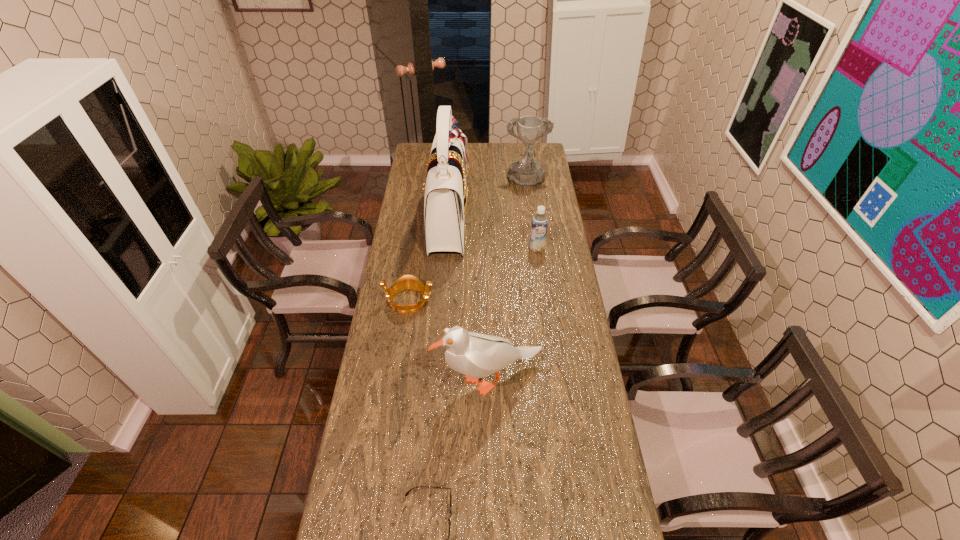
Identify the location of the tallest object. The image size is (960, 540). (x=446, y=196).

Image resolution: width=960 pixels, height=540 pixels. Find the location of `award`. award is located at coordinates (527, 172).

This screenshot has height=540, width=960. I want to click on gull, so click(x=475, y=355).

The image size is (960, 540). In order to click on the third shortest object in this screenshot , I will do `click(539, 223)`.

Locate an element on the screen. This screenshot has width=960, height=540. the second shortest object is located at coordinates (408, 282).

Where is `the fourth farthest object`? The image size is (960, 540). the fourth farthest object is located at coordinates click(408, 282).

This screenshot has height=540, width=960. I want to click on vacant space located on the front-facing side of the tallest object, so click(530, 219).

Find the location of a particular element. The width and height of the screenshot is (960, 540). free spot located 0.370m on the side with emblem of the award is located at coordinates (534, 246).

Where is `blank area located 0.060m at the beak of the second nearest object`? blank area located 0.060m at the beak of the second nearest object is located at coordinates (419, 380).

Find the location of `vacant space located at the beak of the second nearest object`. vacant space located at the beak of the second nearest object is located at coordinates click(x=397, y=380).